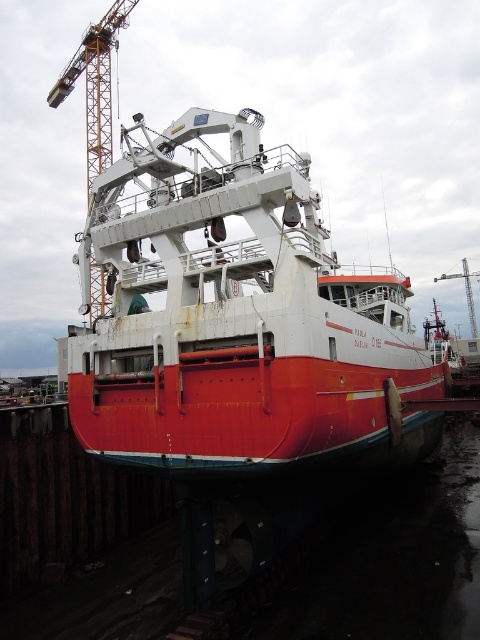
Who is shorter, rusty metal boat at center or metallic yellow crane at upper left?

rusty metal boat at center

Who is taller, rusty metal boat at center or metallic yellow crane at upper left?

Standing taller between the two is metallic yellow crane at upper left.

Is point (444, 358) positioned before point (62, 80)?

Yes, it is.

Image resolution: width=480 pixels, height=640 pixels. I want to click on rusty metal boat at center, so pos(237,321).

Is rusty metal boat at center closer to the viewer compared to brushed metal crane at upper center?

Yes, rusty metal boat at center is in front of brushed metal crane at upper center.

Is rusty metal boat at center below brushed metal crane at upper center?

Yes.

Locate an element on the screen. rusty metal boat at center is located at coordinates (237, 321).

Is metallic yellow crane at upper left below brushed metal crane at upper center?

No, metallic yellow crane at upper left is not below brushed metal crane at upper center.

Between point (82, 64) and point (475, 337), which one is positioned in front?

Point (82, 64) is in front.

Locate an element on the screen. The height and width of the screenshot is (640, 480). metallic yellow crane at upper left is located at coordinates (95, 84).